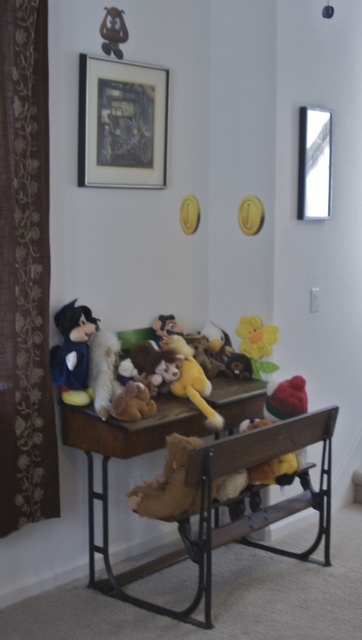
You are a parent trying to arrange toys on a desk for your child. You have a matte blue plush at left and a fluffy yellow stuffed animal at center. The child wants to place a new toy between them. What is the minimum distance the new toy must be placed from each existing toy to fit between them?

The minimum distance the new toy must be placed from each existing toy is 30.04 centimeters, as the total distance between the matte blue plush at left and the fluffy yellow stuffed animal at center is 60.08 centimeters. This ensures the new toy fits exactly between them without overlapping.

In the scene shown: You are organizing a toy shelf and want to place the matte blue plush at left and the fluffy yellow stuffed animal at center side by side. Which toy requires more horizontal space on the shelf?

The fluffy yellow stuffed animal at center requires more horizontal space because its width is greater than the matte blue plush at left.

You are a parent setting up a playroom and want to hang a new picture frame. The metallic rectangular frame at upper right is currently hanging on the wall. Considering the brown floral fabric curtain at left, which object is taller and would require more vertical space?

The brown floral fabric curtain at left is much taller than the metallic rectangular frame at upper right, so it requires more vertical space.